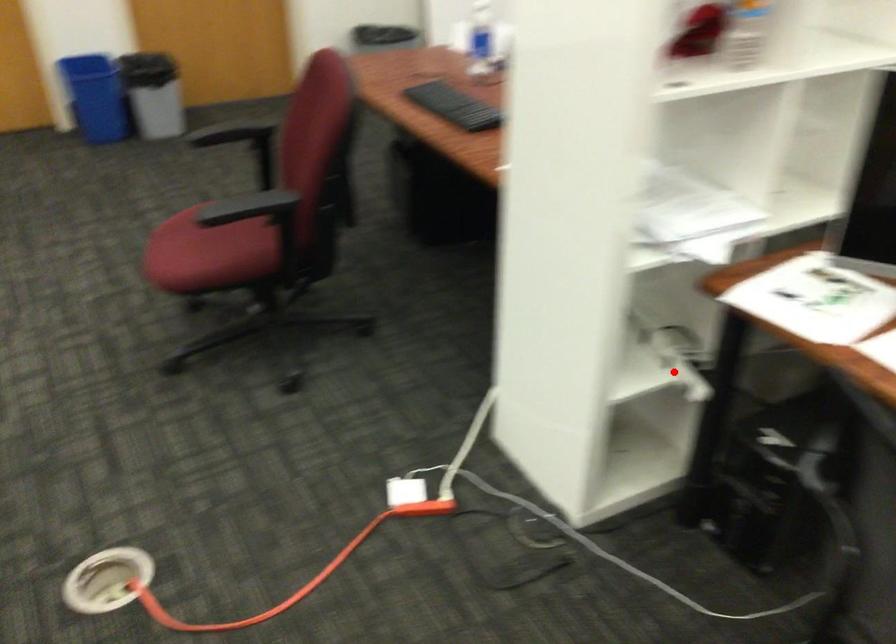
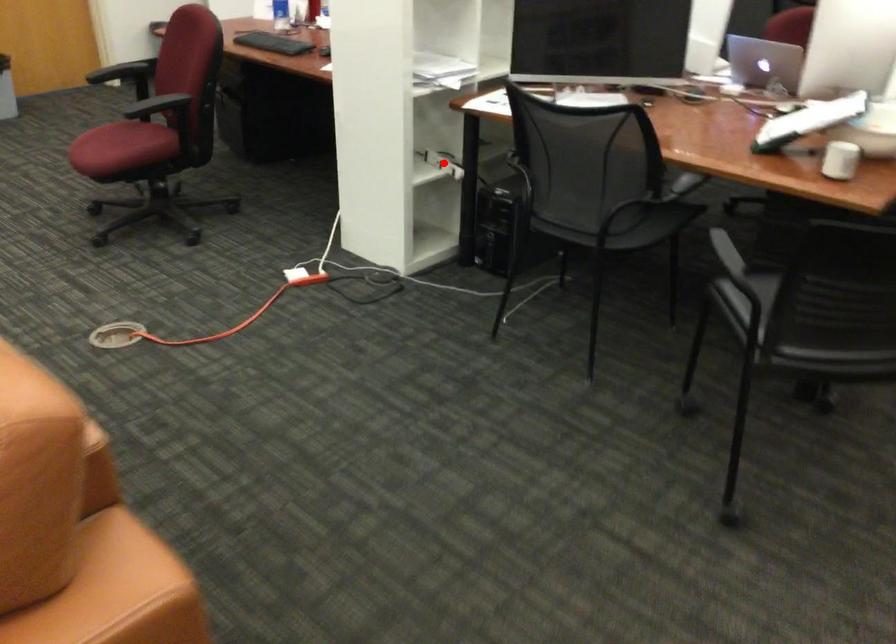
I am providing you with two images of the same scene from different viewpoints. A red point is marked on the first image and another point is marked on the second image. Are the points marked in image1 and image2 representing the same 3D position?

Yes